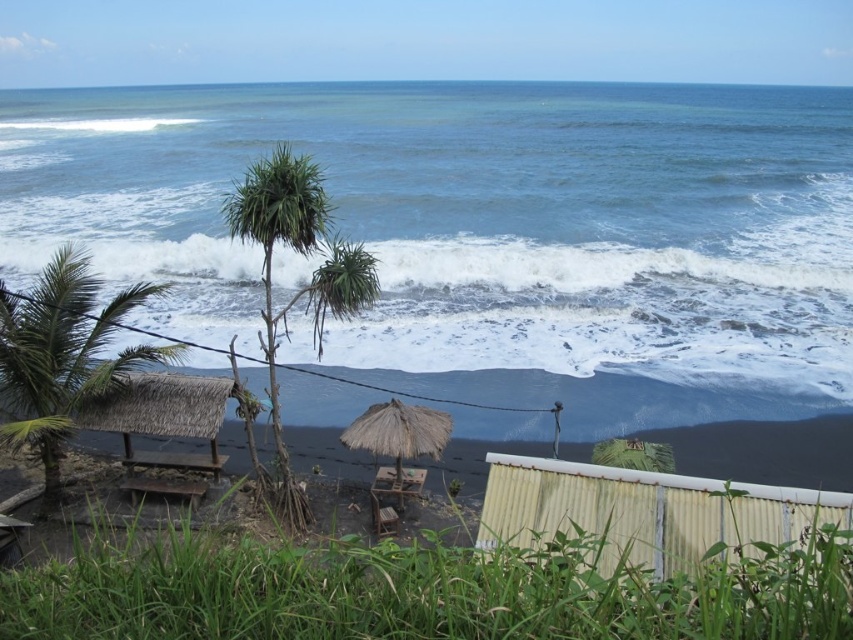
Is green leafy palm tree at lower left closer to camera compared to thatched straw hut at lower left?

Yes, it is.

Describe the element at coordinates (62, 356) in the screenshot. I see `green leafy palm tree at lower left` at that location.

This screenshot has width=853, height=640. I want to click on green leafy palm tree at lower left, so click(62, 356).

The height and width of the screenshot is (640, 853). What do you see at coordinates (271, 257) in the screenshot?
I see `green leafy palm tree at center-left` at bounding box center [271, 257].

Looking at this image, who is taller, green leafy palm tree at center-left or thatched straw umbrella at center?

green leafy palm tree at center-left

Find the location of a particular element. green leafy palm tree at center-left is located at coordinates (271, 257).

Who is higher up, yellow corrugated metal hut at lower right or green leafy palm tree at center-left?

green leafy palm tree at center-left is above.

Is point (714, 547) positioned behind point (283, 308)?

No, (714, 547) is closer to viewer.

Who is more forward, (x=534, y=515) or (x=267, y=310)?

Point (x=534, y=515) is more forward.

Locate an element on the screen. The image size is (853, 640). yellow corrugated metal hut at lower right is located at coordinates (643, 513).